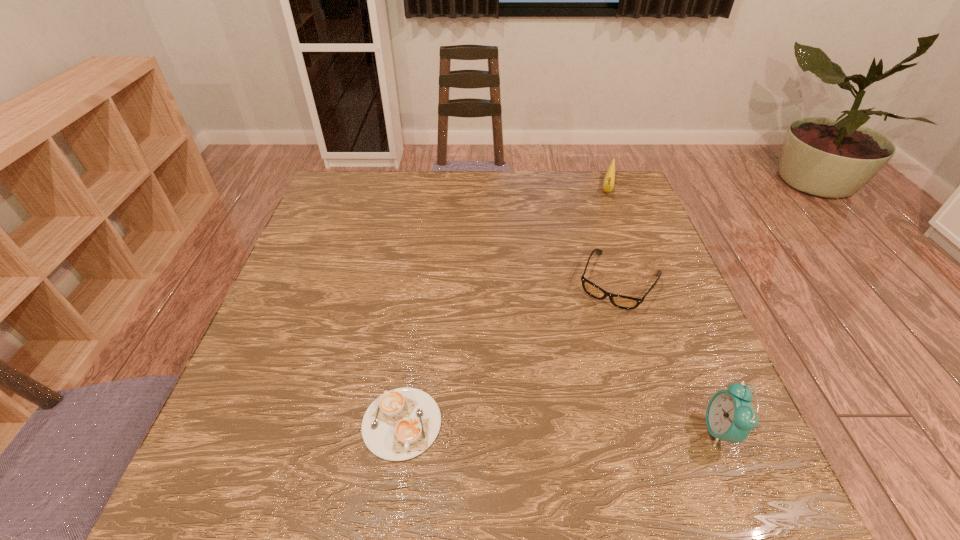
You are a GUI agent. You are given a task and a screenshot of the screen. Output one action in this format:
    pyautogui.click(x=<x>, y=<y>)
    Task: Click on the free region at the far right corner
    The height and width of the screenshot is (540, 960).
    Given the screenshot: What is the action you would take?
    pyautogui.click(x=621, y=186)

Where is `free space between the second tallest object and the leftmost object`? This screenshot has height=540, width=960. free space between the second tallest object and the leftmost object is located at coordinates (504, 306).

I want to click on free space between the alarm clock and the banana, so click(663, 309).

Find the location of `free point between the tallest object and the third nearest object`. free point between the tallest object and the third nearest object is located at coordinates (669, 356).

You are a GUI agent. You are given a task and a screenshot of the screen. Output one action in this format:
    pyautogui.click(x=<x>, y=<y>)
    Task: Click on the vacant area that lies between the leftmost object and the tallest object
    
    Given the screenshot: What is the action you would take?
    pyautogui.click(x=561, y=427)

The height and width of the screenshot is (540, 960). In order to click on free area in between the third shortest object and the spectacles in this screenshot , I will do `click(612, 235)`.

Find the location of a particular element. The image size is (960, 540). vacant space in between the second tallest object and the third nearest object is located at coordinates (612, 235).

This screenshot has height=540, width=960. What are the coordinates of `vacant area that lies between the shortest object and the tallest object` in the screenshot? It's located at pyautogui.click(x=561, y=427).

Image resolution: width=960 pixels, height=540 pixels. I want to click on free space between the alarm clock and the third shortest object, so click(663, 309).

Find the location of a particular element. The image size is (960, 540). vacant space in between the alarm clock and the spectacles is located at coordinates (669, 356).